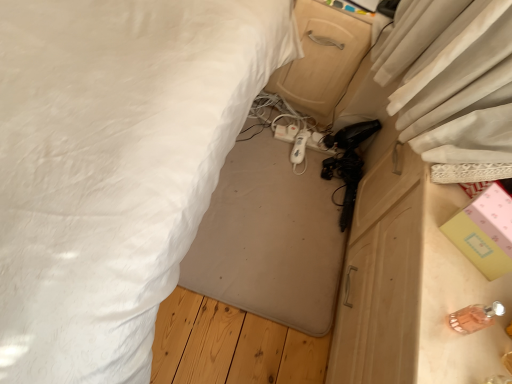
Identify the location of vacant space in front of wooden drawer at center. [x=284, y=150].